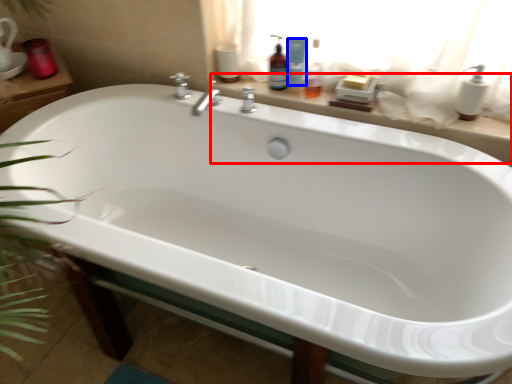
Question: Which object is closer to the camera taking this photo, window sill (highlighted by a red box) or cleaning product (highlighted by a blue box)?

Choices:
 (A) window sill
 (B) cleaning product

Answer: (A)